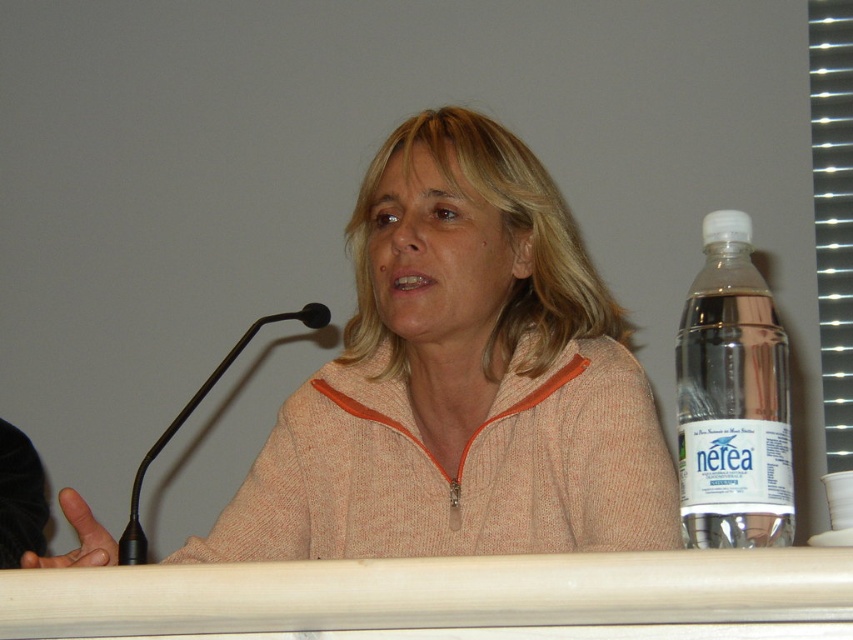
You are a photographer setting up for a portrait session. You notice the point at coordinates (461,380) in the image. What object is located at this point?

The point at coordinates (461,380) indicates the orange knit sweater at center.

You are organizing a small event and need to place a name tag on the table. The name tag is 10 cm wide. You have the clear plastic bottle at right and the black plastic microphone at left on the table. Can you fit the name tag between them without moving either object?

The clear plastic bottle at right occupies less space than the black plastic microphone at left, so there should be enough space between them to place the 10 cm wide name tag.

Looking at this image, you are a photographer setting up for a portrait. You need to focus on the black plastic microphone at left and the clear plastic bottle at right. Which object should you adjust your camera focus for first if you want to ensure both are in focus?

The clear plastic bottle at right is closer to the viewer than the black plastic microphone at left. To ensure both are in focus, you should focus on the black plastic microphone at left first, as it is farther away, allowing the depth of field to cover the closer bottle.